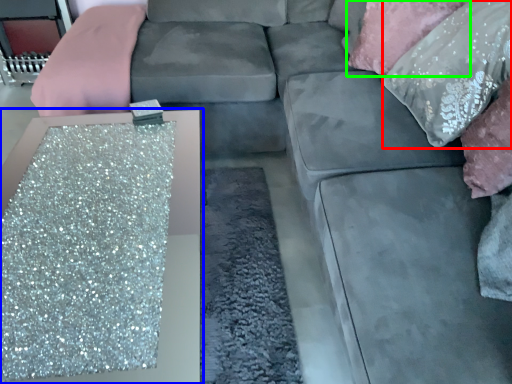
Question: Which object is positioned farthest from pillow (highlighted by a red box)? Select from table (highlighted by a blue box) and pillow (highlighted by a green box).

Choices:
 (A) table
 (B) pillow

Answer: (A)